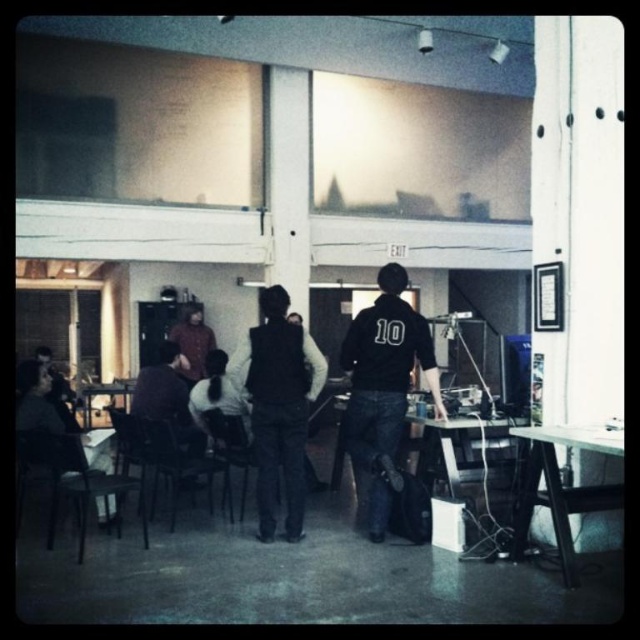
Does black matte vest at center have a lesser width compared to dark brown leather jacket at center?

Yes, black matte vest at center is thinner than dark brown leather jacket at center.

Does black matte vest at center appear on the left side of dark brown leather jacket at center?

No, black matte vest at center is not to the left of dark brown leather jacket at center.

Who is more distant from viewer, (260, 304) or (157, 368)?

The point (260, 304) is more distant.

Find the location of a particular element. black matte vest at center is located at coordinates (280, 406).

Is black matte jacket at center to the right of black matte vest at center from the viewer's perspective?

Indeed, black matte jacket at center is positioned on the right side of black matte vest at center.

Which is in front, point (417, 321) or point (317, 388)?

Point (417, 321) is in front.

This screenshot has height=640, width=640. I want to click on black matte jacket at center, so click(381, 392).

Which is in front, point (269, 516) or point (182, 372)?

Point (269, 516) is more forward.

Consider the image. Does black matte vest at center have a lesser width compared to matte brown jacket at center?

No, black matte vest at center is not thinner than matte brown jacket at center.

Where is `black matte vest at center`? black matte vest at center is located at coordinates (280, 406).